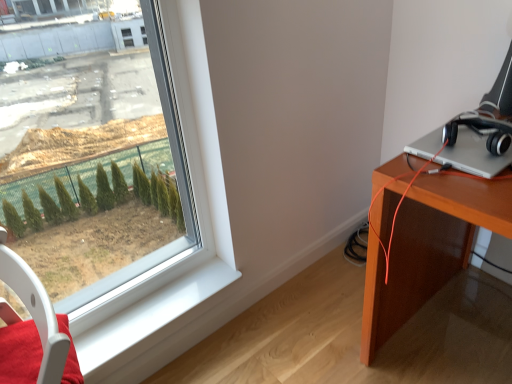
Question: Is black matte headphones at right aimed at white glossy window sill at lower left?

Choices:
 (A) yes
 (B) no

Answer: (B)

Question: Would you say black matte headphones at right is outside white glossy window sill at lower left?

Choices:
 (A) no
 (B) yes

Answer: (B)

Question: Considering the relative positions of black matte headphones at right and white glossy window sill at lower left in the image provided, is black matte headphones at right behind white glossy window sill at lower left?

Choices:
 (A) no
 (B) yes

Answer: (A)

Question: Considering the relative sizes of black matte headphones at right and white glossy window sill at lower left in the image provided, is black matte headphones at right thinner than white glossy window sill at lower left?

Choices:
 (A) no
 (B) yes

Answer: (B)

Question: Is black matte headphones at right to the right of white glossy window sill at lower left from the viewer's perspective?

Choices:
 (A) no
 (B) yes

Answer: (B)

Question: Is white glossy window sill at lower left in front of or behind white plastic swivel chair at lower left in the image?

Choices:
 (A) front
 (B) behind

Answer: (B)

Question: Is white glossy window sill at lower left inside the boundaries of white plastic swivel chair at lower left, or outside?

Choices:
 (A) outside
 (B) inside

Answer: (A)

Question: From a real-world perspective, is white glossy window sill at lower left physically located above or below white plastic swivel chair at lower left?

Choices:
 (A) above
 (B) below

Answer: (B)

Question: In terms of size, does white glossy window sill at lower left appear bigger or smaller than white plastic swivel chair at lower left?

Choices:
 (A) small
 (B) big

Answer: (A)

Question: Considering the positions of clear glass window at left and black matte headphones at right in the image, is clear glass window at left bigger or smaller than black matte headphones at right?

Choices:
 (A) small
 (B) big

Answer: (B)

Question: Is clear glass window at left wider or thinner than black matte headphones at right?

Choices:
 (A) wide
 (B) thin

Answer: (B)

Question: Which is correct: clear glass window at left is inside black matte headphones at right, or outside of it?

Choices:
 (A) inside
 (B) outside

Answer: (B)

Question: From a real-world perspective, is clear glass window at left positioned above or below black matte headphones at right?

Choices:
 (A) above
 (B) below

Answer: (B)

Question: Relative to white glossy window sill at lower left, is silver metallic laptop at upper right in front or behind?

Choices:
 (A) behind
 (B) front

Answer: (B)

Question: Is point (426, 134) positioned closer to the camera than point (131, 339)?

Choices:
 (A) closer
 (B) farther

Answer: (B)